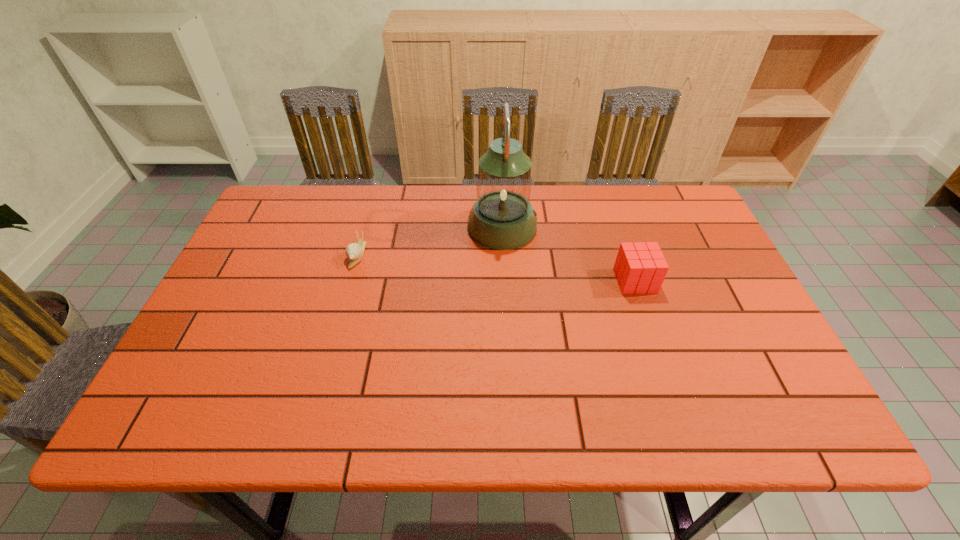
Locate an element on the screen. The width and height of the screenshot is (960, 540). blank space at the far edge is located at coordinates (550, 199).

You are a GUI agent. You are given a task and a screenshot of the screen. Output one action in this format:
    pyautogui.click(x=<x>, y=<y>)
    Task: Click on the free location at the near edge of the desktop
    This screenshot has height=540, width=960.
    Given the screenshot: What is the action you would take?
    pyautogui.click(x=380, y=406)

The image size is (960, 540). I want to click on vacant area at the left edge of the desktop, so click(242, 263).

In order to click on vacant space at the right edge of the desktop in this screenshot , I will do `click(689, 290)`.

In the image, there is a desktop. Where is `free space at the far left corner`? free space at the far left corner is located at coordinates (282, 227).

At what (x,y) coordinates should I click in order to perform the action: click on vacant space that is in between the second tallest object and the escargot. Please return your answer as a coordinate pair (x, y). This screenshot has height=540, width=960. Looking at the image, I should click on (496, 268).

You are a GUI agent. You are given a task and a screenshot of the screen. Output one action in this format:
    pyautogui.click(x=<x>, y=<y>)
    Task: Click on the vacant point located between the rightmost object and the escargot
    
    Given the screenshot: What is the action you would take?
    pyautogui.click(x=496, y=268)

This screenshot has height=540, width=960. What are the coordinates of `free space between the leftmost object and the tallest object` in the screenshot? It's located at (430, 241).

You are a GUI agent. You are given a task and a screenshot of the screen. Output one action in this format:
    pyautogui.click(x=<x>, y=<y>)
    Task: Click on the vacant space that's between the tallest object and the escargot
    This screenshot has height=540, width=960.
    Given the screenshot: What is the action you would take?
    pyautogui.click(x=430, y=241)

You are a GUI agent. You are given a task and a screenshot of the screen. Output one action in this format:
    pyautogui.click(x=<x>, y=<y>)
    Task: Click on the empty space that is in between the cube and the tallest object
    
    Given the screenshot: What is the action you would take?
    pyautogui.click(x=568, y=254)